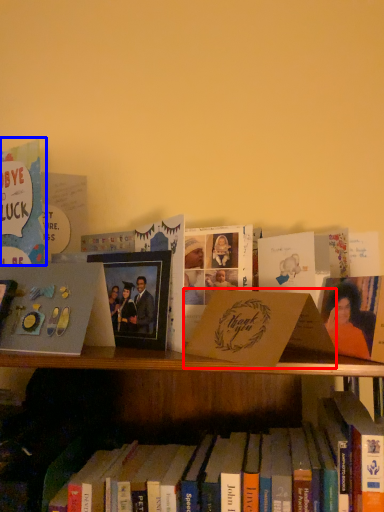
Question: Which object is closer to the camera taking this photo, paperback book (highlighted by a red box) or book (highlighted by a blue box)?

Choices:
 (A) paperback book
 (B) book

Answer: (A)